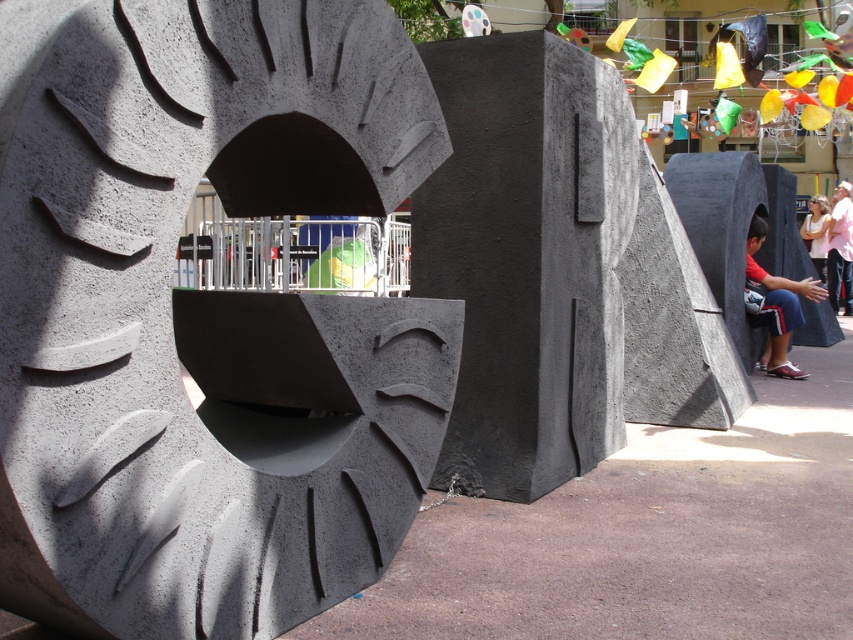
Question: Which point appears closest to the camera in this image?

Choices:
 (A) (833, 257)
 (B) (837, 189)

Answer: (A)

Question: Can you confirm if white shirt at lower right is smaller than smooth skin face at center?

Choices:
 (A) no
 (B) yes

Answer: (A)

Question: Among these objects, which one is nearest to the camera?

Choices:
 (A) red shirt at right
 (B) matte black face at center
 (C) matte gray tire at center

Answer: (C)

Question: Based on their relative distances, which object is nearer to the matte black face at center?

Choices:
 (A) matte gray tire at center
 (B) white shirt at lower right
 (C) smooth skin face at center

Answer: (C)

Question: Is white shirt at lower right thinner than matte black face at center?

Choices:
 (A) no
 (B) yes

Answer: (A)

Question: Can you confirm if matte gray tire at center is positioned to the right of smooth skin face at center?

Choices:
 (A) yes
 (B) no

Answer: (B)